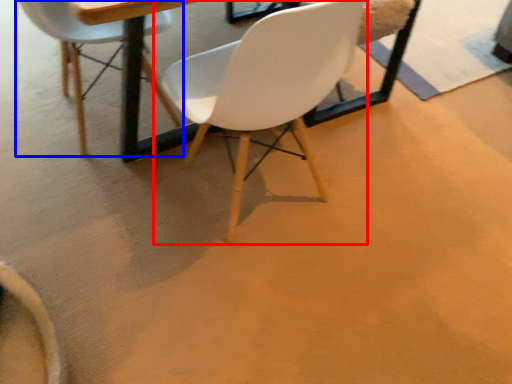
Question: Which object is further to the camera taking this photo, chair (highlighted by a red box) or chair (highlighted by a blue box)?

Choices:
 (A) chair
 (B) chair

Answer: (B)